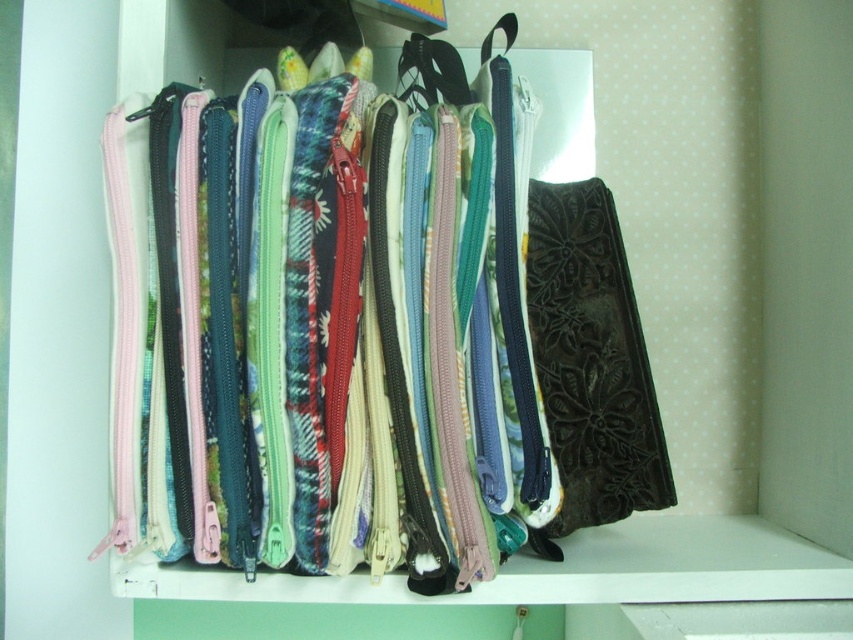
Which is behind, point (201, 198) or point (543, 374)?

The point (543, 374) is more distant.

Can you confirm if textured fabric zipper pouches at center is positioned to the right of velvet floral pouch at center?

No, textured fabric zipper pouches at center is not to the right of velvet floral pouch at center.

Where is `textured fabric zipper pouches at center`? textured fabric zipper pouches at center is located at coordinates (427, 346).

Locate an element on the screen. The image size is (853, 640). textured fabric zipper pouches at center is located at coordinates (427, 346).

Which of these two, textured fabric zipper pouches at center or matte black strap at center, stands taller?

With more height is textured fabric zipper pouches at center.

Locate an element on the screen. textured fabric zipper pouches at center is located at coordinates (427, 346).

Where is `textured fabric zipper pouches at center`? textured fabric zipper pouches at center is located at coordinates (427, 346).

This screenshot has width=853, height=640. Identify the location of textured fabric zipper pouches at center. (427, 346).

Does velvet floral pouch at center come behind matte black strap at center?

No.

Is velvet floral pouch at center wider than matte black strap at center?

Correct, the width of velvet floral pouch at center exceeds that of matte black strap at center.

Which is behind, point (619, 497) or point (440, 52)?

Point (619, 497)

Find the location of `velvet floral pouch at center`. velvet floral pouch at center is located at coordinates tap(590, 358).